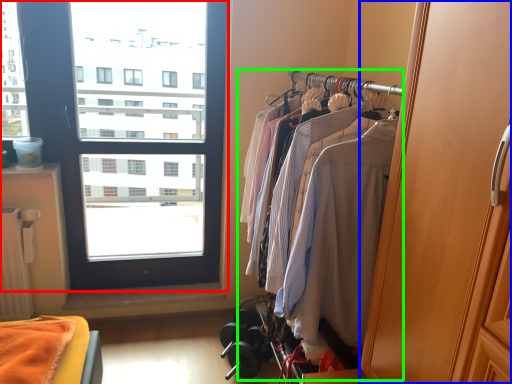
Question: Estimate the real-world distances between objects in this image. Which object is farther from window (highlighted by a red box), screen door (highlighted by a blue box) or closet (highlighted by a green box)?

Choices:
 (A) screen door
 (B) closet

Answer: (A)